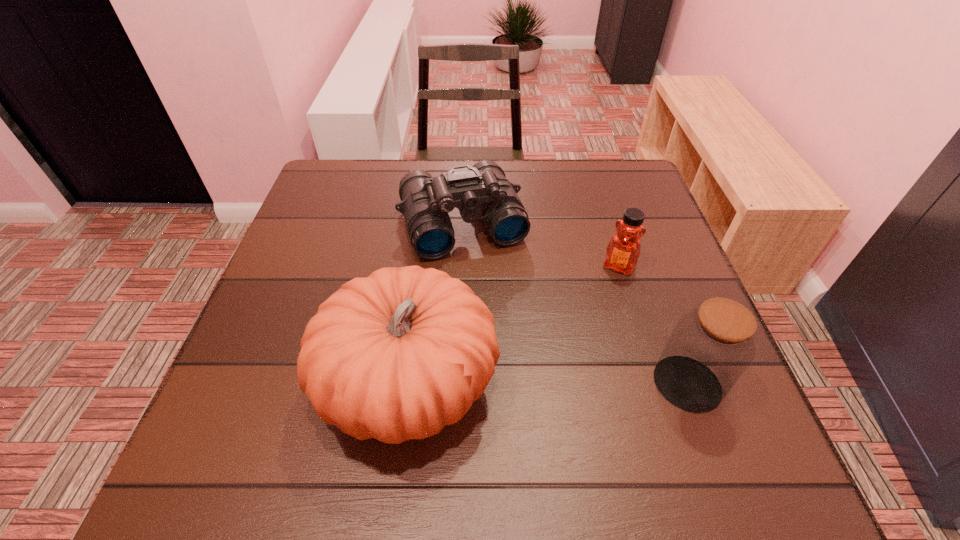
I want to click on pumpkin, so click(x=397, y=355).

I want to click on jar, so click(x=710, y=347).

Where is `honey`? honey is located at coordinates (623, 250).

Find the location of `binoculars`. binoculars is located at coordinates (482, 190).

The width and height of the screenshot is (960, 540). Find the location of `free space located 0.130m on the back of the pumpkin`. free space located 0.130m on the back of the pumpkin is located at coordinates (424, 273).

The width and height of the screenshot is (960, 540). I want to click on vacant space located 0.380m on the left of the jar, so click(443, 383).

Find the location of a particular element. This screenshot has height=540, width=960. vacant point located on the front label of the honey is located at coordinates (595, 316).

Identify the location of free location located 0.370m on the front label of the honey. [x=550, y=412].

At what (x,y) coordinates should I click in order to perform the action: click on free space located on the front label of the honey. Please return your answer as a coordinate pair (x, y). The height and width of the screenshot is (540, 960). Looking at the image, I should click on (562, 389).

I want to click on free spot located through the lenses of the binoculars, so click(x=486, y=281).